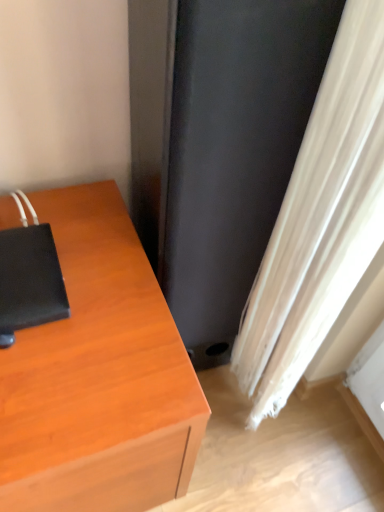
Question: From a real-world perspective, is black matte notebook at left above or below white textured curtain at lower right?

Choices:
 (A) above
 (B) below

Answer: (A)

Question: Is point (18, 321) closer or farther from the camera than point (359, 77)?

Choices:
 (A) closer
 (B) farther

Answer: (B)

Question: Estimate the real-world distances between objects in this image. Which object is closer to the black matte notebook at left?

Choices:
 (A) white textured curtain at lower right
 (B) black matte screen door at center

Answer: (B)

Question: Which is nearer to the black matte notebook at left?

Choices:
 (A) white textured curtain at lower right
 (B) black matte screen door at center

Answer: (B)